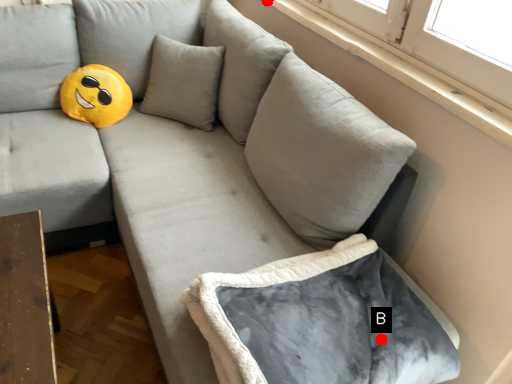
Question: Two points are circled on the image, labeled by A and B beside each circle. Which of the following is the farthest from the observer?

Choices:
 (A) A is further
 (B) B is further

Answer: (A)